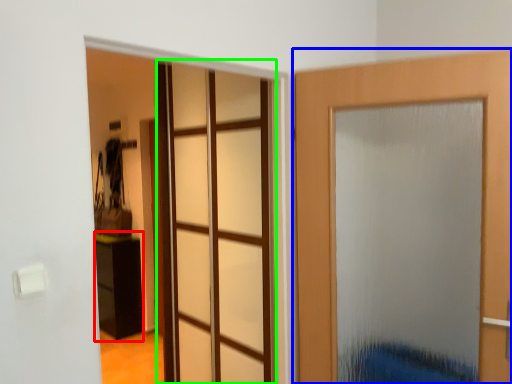
Question: Which is farther away from furniture (highlighted by a red box)? door (highlighted by a blue box) or glass door (highlighted by a green box)?

Choices:
 (A) door
 (B) glass door

Answer: (A)